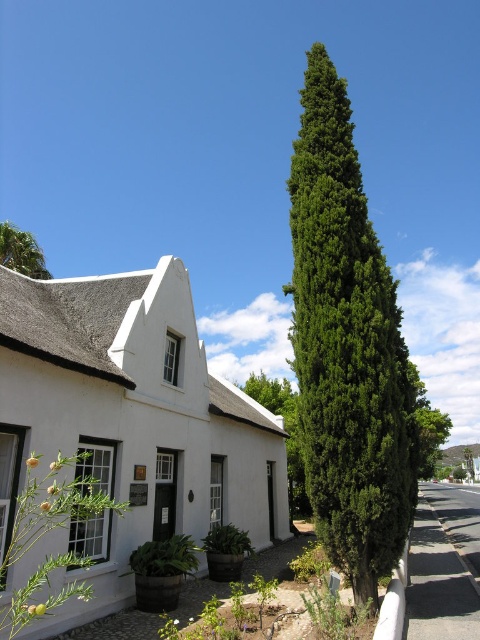
You are a visitor standing at the entrance of the white building. You want to take a photo of the green leafy bush at center without the green leafy tree at upper left blocking the view. Which direction should you move to achieve this?

The green leafy bush at center is behind the green leafy tree at upper left, so you should move to the right side of the tree to take the photo so the bush is visible without obstruction.

You are a gardener planning to trim both the green leafy tree at upper left and the green leafy bush at center. Which one requires more time to trim based on their sizes?

The green leafy tree at upper left requires more time to trim because it is bigger than the green leafy bush at center.